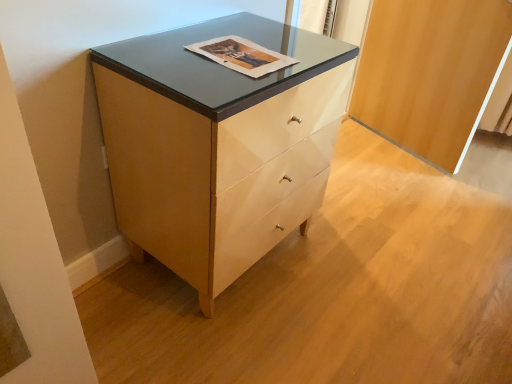
Locate an element on the screen. This screenshot has width=512, height=384. matte white chest of drawers at center is located at coordinates (218, 144).

Describe the element at coordinates (218, 144) in the screenshot. The width and height of the screenshot is (512, 384). I see `matte white chest of drawers at center` at that location.

Locate an element on the screen. This screenshot has width=512, height=384. matte white chest of drawers at center is located at coordinates (218, 144).